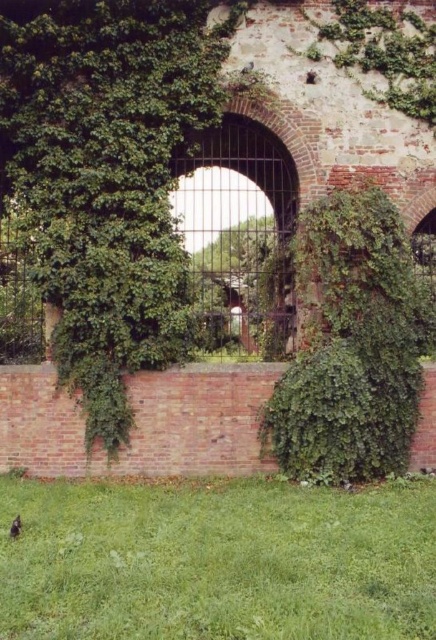
Who is more distant from viewer, [395,593] or [10,536]?

Positioned behind is point [10,536].

Is green grass at lower center further to camera compared to shiny black bird at lower left?

No.

Is point (88, 584) farther from viewer compared to point (13, 531)?

No, it is not.

This screenshot has height=640, width=436. I want to click on green grass at lower center, so click(x=217, y=561).

Can you confirm if green leafy ivy at center is positioned to the right of shiny black bird at lower left?

Indeed, green leafy ivy at center is positioned on the right side of shiny black bird at lower left.

At what (x,y) coordinates should I click in order to perform the action: click on green leafy ivy at center. Please return your answer as a coordinate pair (x, y). The image size is (436, 640). Looking at the image, I should click on (351, 342).

Locate an element on the screen. Image resolution: width=436 pixels, height=640 pixels. green leafy ivy at center is located at coordinates (351, 342).

Between green grass at lower center and green leafy ivy at center, which one appears on the right side from the viewer's perspective?

Positioned to the right is green leafy ivy at center.

Consider the image. How distant is green grass at lower center from green leafy ivy at center?

green grass at lower center is 3.14 meters from green leafy ivy at center.

Is point (343, 513) behind point (368, 385)?

No, it is in front of (368, 385).

Locate an element on the screen. This screenshot has height=640, width=436. green grass at lower center is located at coordinates (217, 561).